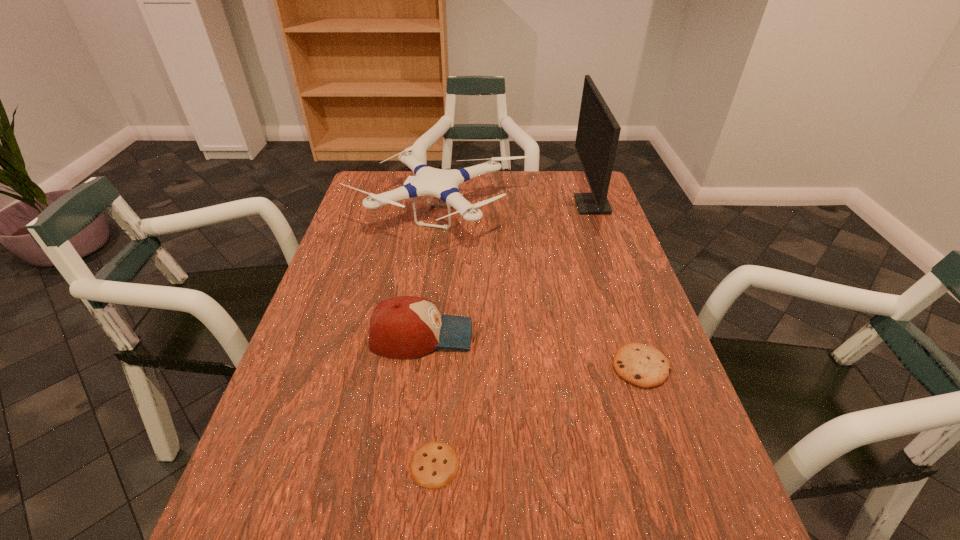
Locate an element on the screen. Image resolution: width=960 pixels, height=540 pixels. the tallest object is located at coordinates (598, 131).

What are the coordinates of `the second tallest object` in the screenshot? It's located at (444, 184).

Locate an element on the screen. the third shortest object is located at coordinates (405, 326).

You are a GUI agent. You are given a task and a screenshot of the screen. Output one action in this format:
    pyautogui.click(x=<x>, y=<y>)
    Task: Click on the second shortest object
    This screenshot has height=540, width=960.
    Given the screenshot: What is the action you would take?
    pyautogui.click(x=644, y=366)

The image size is (960, 540). I want to click on the taller cookie, so click(x=644, y=366).

This screenshot has height=540, width=960. In order to click on the shorter cookie in this screenshot , I will do `click(435, 464)`.

At what (x,y) coordinates should I click in order to perform the action: click on the nearer cookie. Please return your answer as a coordinate pair (x, y). The image size is (960, 540). Looking at the image, I should click on (435, 464).

You are a GUI agent. You are given a task and a screenshot of the screen. Output one action in this format:
    pyautogui.click(x=<x>, y=<y>)
    Task: Click on the free region located on the front-facing side of the computer monitor
    
    Given the screenshot: What is the action you would take?
    pyautogui.click(x=548, y=205)

Image resolution: width=960 pixels, height=540 pixels. I want to click on free point located on the front-facing side of the computer monitor, so click(x=471, y=205).

Where is `blank area located 0.300m on the front-facing side of the computer monitor`? blank area located 0.300m on the front-facing side of the computer monitor is located at coordinates tap(484, 205).